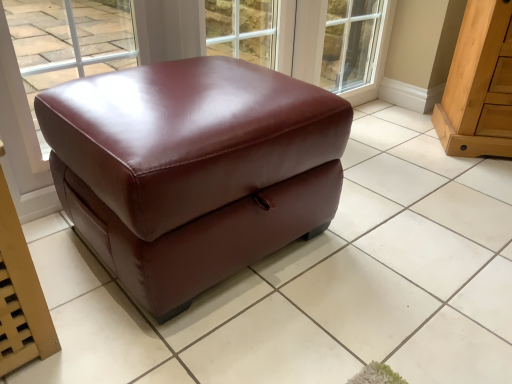
Question: Is light brown wood drawer at right, which appears as the second furniture when viewed from the left, in front of satin brown leather ottoman at center, the 1th furniture from the left?

Choices:
 (A) no
 (B) yes

Answer: (A)

Question: Considering the relative positions of light brown wood drawer at right, placed as the 1th furniture when sorted from right to left, and satin brown leather ottoman at center, the 2th furniture in the right-to-left sequence, in the image provided, is light brown wood drawer at right, placed as the 1th furniture when sorted from right to left, behind satin brown leather ottoman at center, the 2th furniture in the right-to-left sequence,?

Choices:
 (A) no
 (B) yes

Answer: (B)

Question: Considering the relative sizes of light brown wood drawer at right, which appears as the second furniture when viewed from the left, and satin brown leather ottoman at center, the 2th furniture in the right-to-left sequence, in the image provided, is light brown wood drawer at right, which appears as the second furniture when viewed from the left, bigger than satin brown leather ottoman at center, the 2th furniture in the right-to-left sequence,?

Choices:
 (A) no
 (B) yes

Answer: (A)

Question: Is satin brown leather ottoman at center, the 2th furniture in the right-to-left sequence, located within light brown wood drawer at right, which appears as the second furniture when viewed from the left?

Choices:
 (A) yes
 (B) no

Answer: (B)

Question: From the image's perspective, would you say light brown wood drawer at right, placed as the 1th furniture when sorted from right to left, is shown under satin brown leather ottoman at center, the 1th furniture from the left?

Choices:
 (A) yes
 (B) no

Answer: (B)

Question: Would you say satin brown leather ottoman at center, the 2th furniture in the right-to-left sequence, is to the left or to the right of transparent glass window at upper center in the picture?

Choices:
 (A) left
 (B) right

Answer: (B)

Question: From the image's perspective, is satin brown leather ottoman at center, the 2th furniture in the right-to-left sequence, located above or below transparent glass window at upper center?

Choices:
 (A) above
 (B) below

Answer: (B)

Question: From a real-world perspective, is satin brown leather ottoman at center, the 1th furniture from the left, physically located above or below transparent glass window at upper center?

Choices:
 (A) below
 (B) above

Answer: (A)

Question: In terms of width, does satin brown leather ottoman at center, the 1th furniture from the left, look wider or thinner when compared to transparent glass window at upper center?

Choices:
 (A) wide
 (B) thin

Answer: (A)

Question: Considering the positions of light brown wood drawer at right, which appears as the second furniture when viewed from the left, and satin brown leather ottoman at center, the 1th furniture from the left, in the image, is light brown wood drawer at right, which appears as the second furniture when viewed from the left, wider or thinner than satin brown leather ottoman at center, the 1th furniture from the left,?

Choices:
 (A) wide
 (B) thin

Answer: (B)

Question: Considering the positions of light brown wood drawer at right, placed as the 1th furniture when sorted from right to left, and satin brown leather ottoman at center, the 1th furniture from the left, in the image, is light brown wood drawer at right, placed as the 1th furniture when sorted from right to left, taller or shorter than satin brown leather ottoman at center, the 1th furniture from the left,?

Choices:
 (A) short
 (B) tall

Answer: (B)

Question: Based on their sizes in the image, would you say light brown wood drawer at right, placed as the 1th furniture when sorted from right to left, is bigger or smaller than satin brown leather ottoman at center, the 2th furniture in the right-to-left sequence?

Choices:
 (A) small
 (B) big

Answer: (A)

Question: From a real-world perspective, is light brown wood drawer at right, placed as the 1th furniture when sorted from right to left, positioned above or below satin brown leather ottoman at center, the 1th furniture from the left?

Choices:
 (A) below
 (B) above

Answer: (B)

Question: In the image, is transparent glass window at upper center on the left side or the right side of light brown wood drawer at right, which appears as the second furniture when viewed from the left?

Choices:
 (A) left
 (B) right

Answer: (A)

Question: Is transparent glass window at upper center spatially inside light brown wood drawer at right, which appears as the second furniture when viewed from the left, or outside of it?

Choices:
 (A) outside
 (B) inside

Answer: (A)